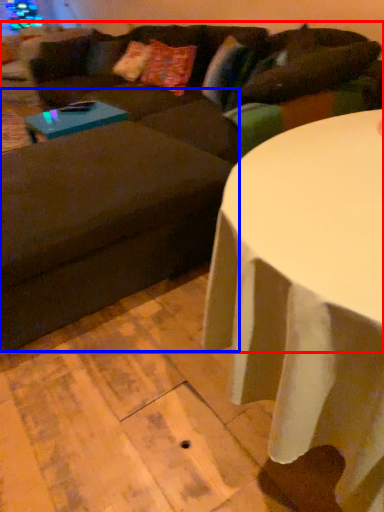
Question: Among these objects, which one is nearest to the camera, studio couch (highlighted by a red box) or swivel chair (highlighted by a blue box)?

Choices:
 (A) studio couch
 (B) swivel chair

Answer: (A)